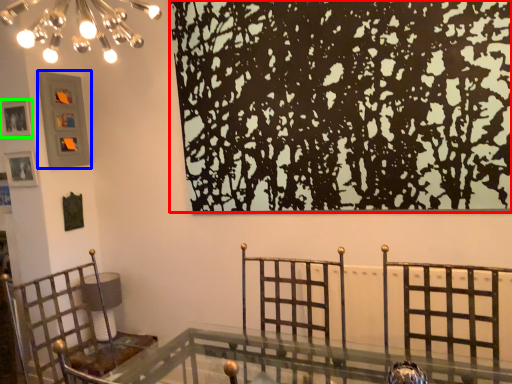
Question: Considering the real-world distances, which object is closest to tree (highlighted by a red box)? picture frame (highlighted by a blue box) or picture frame (highlighted by a green box).

Choices:
 (A) picture frame
 (B) picture frame

Answer: (A)